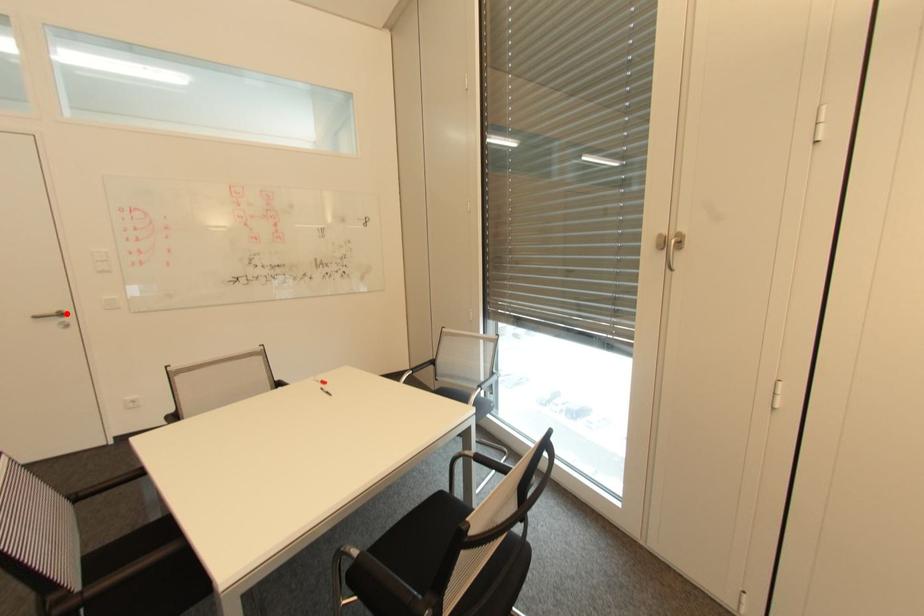
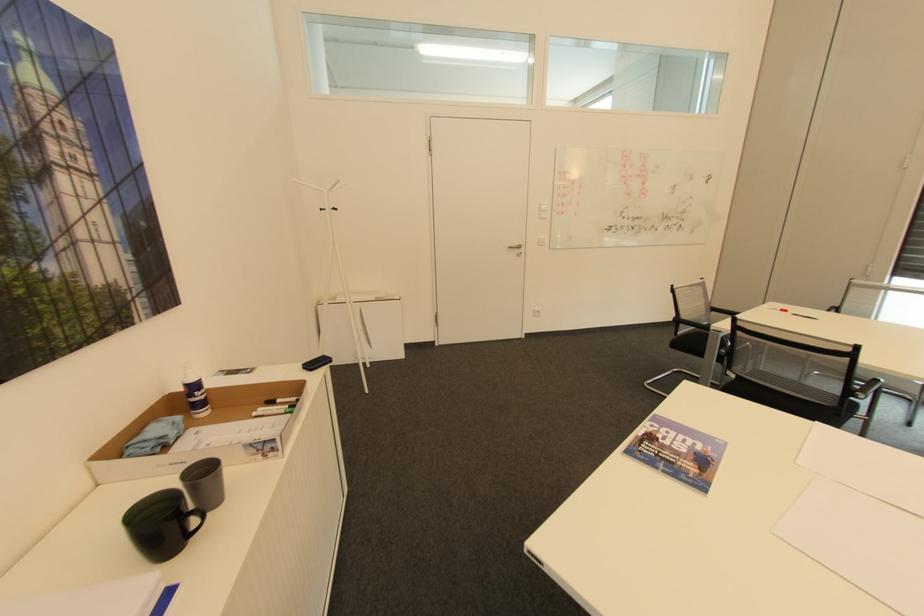
In the second image, find the point that corresponds to the highlighted location in the first image.

(524, 246)